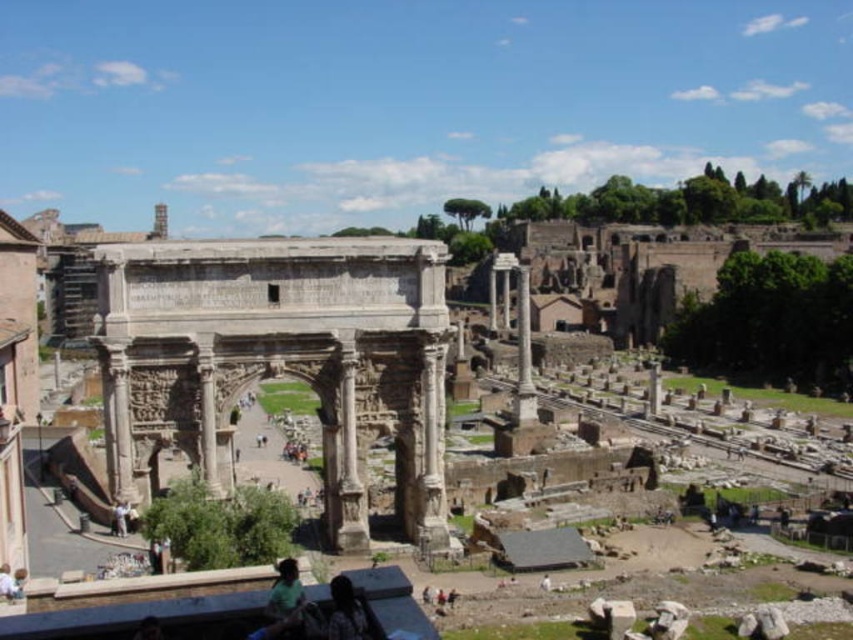
Is point (430, 392) behind point (345, 609)?

Yes, point (430, 392) is farther from viewer.

Which is behind, point (428, 406) or point (364, 621)?

Point (428, 406)

Locate an element on the screen. This screenshot has width=853, height=640. carved stone column at center is located at coordinates tap(431, 454).

Between stone arch at center and dark hair at lower center, which one is positioned lower?

dark hair at lower center is below.

Consider the image. Can you confirm if stone arch at center is positioned below dark hair at lower center?

Actually, stone arch at center is above dark hair at lower center.

Who is more forward, (123,294) or (358,612)?

Positioned in front is point (358,612).

Locate an element on the screen. Image resolution: width=853 pixels, height=640 pixels. stone arch at center is located at coordinates (268, 355).

At what (x,y) coordinates should I click in order to perform the action: click on carved stone column at center. Please return your answer as a coordinate pair (x, y). Looking at the image, I should click on (431, 454).

How much distance is there between carved stone column at center and smooth stone column at center?

40.17 meters

Locate an element on the screen. The width and height of the screenshot is (853, 640). carved stone column at center is located at coordinates (431, 454).

Locate an element on the screen. This screenshot has height=640, width=853. carved stone column at center is located at coordinates (431, 454).